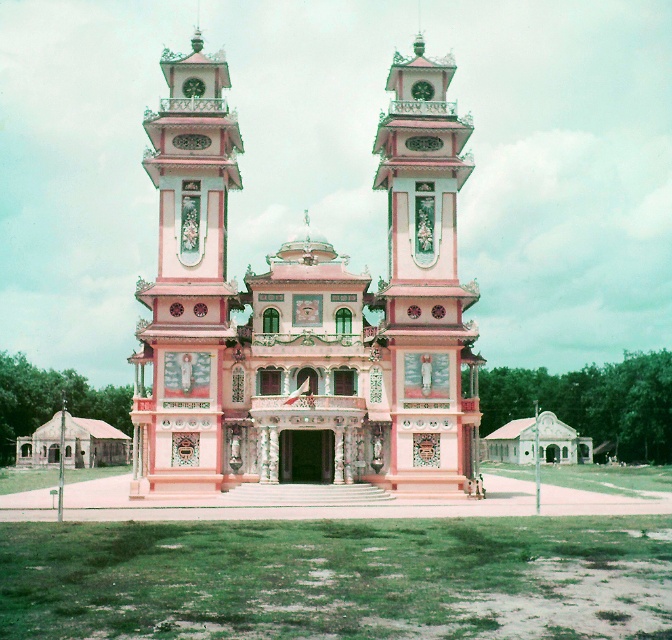
Who is positioned more to the right, pink glossy clock tower at left or pink glossy bell tower at center?

pink glossy bell tower at center

Who is shorter, pink glossy clock tower at left or pink glossy bell tower at center?

pink glossy bell tower at center

The height and width of the screenshot is (640, 672). Describe the element at coordinates (185, 280) in the screenshot. I see `pink glossy clock tower at left` at that location.

Identify the location of pink glossy clock tower at left. [185, 280].